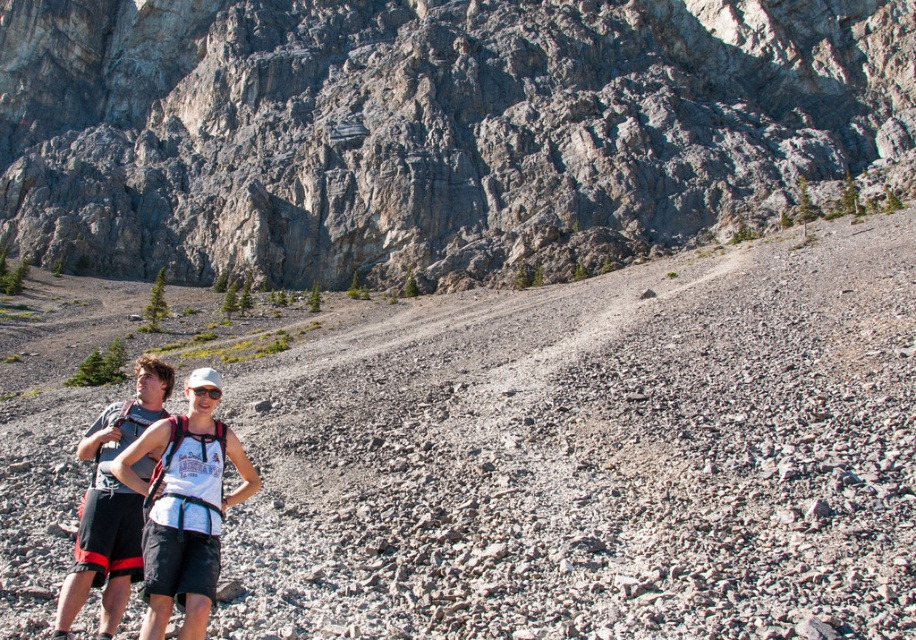
Measure the distance between point [243,163] and camera.

A distance of 391.09 feet exists between point [243,163] and camera.

Which is more to the right, gray rocky mountain at upper center or white mesh tank top at center?

From the viewer's perspective, white mesh tank top at center appears more on the right side.

What do you see at coordinates (433, 131) in the screenshot? I see `gray rocky mountain at upper center` at bounding box center [433, 131].

The height and width of the screenshot is (640, 916). Identify the location of gray rocky mountain at upper center. (433, 131).